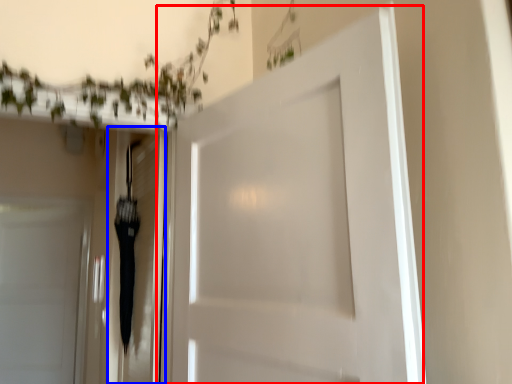
Question: Which object is further to the camera taking this photo, door (highlighted by a red box) or elevator (highlighted by a blue box)?

Choices:
 (A) door
 (B) elevator

Answer: (B)